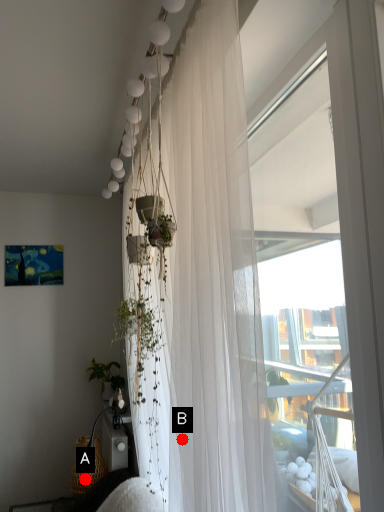
Question: Two points are circled on the image, labeled by A and B beside each circle. Among these points, which one is farthest from the camera?

Choices:
 (A) A is further
 (B) B is further

Answer: (A)